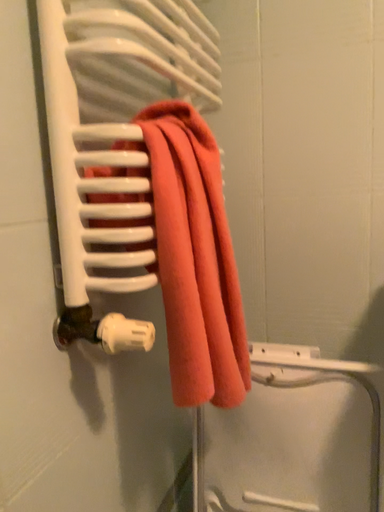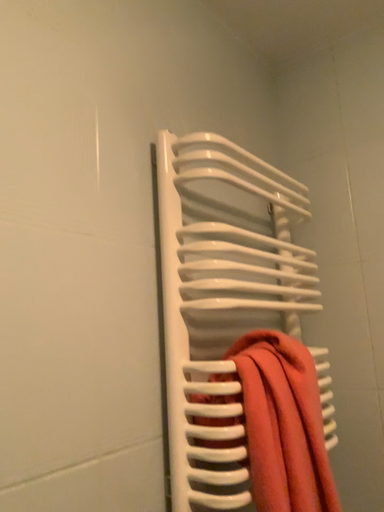
Question: How did the camera likely rotate when shooting the video?

Choices:
 (A) rotated upward
 (B) rotated downward

Answer: (A)